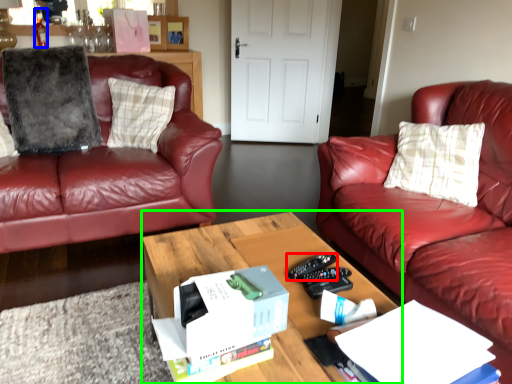
Question: Considering the real-world distances, which object is farthest from remote control (highlighted by a red box)? bottle (highlighted by a blue box) or coffee table (highlighted by a green box)?

Choices:
 (A) bottle
 (B) coffee table

Answer: (A)